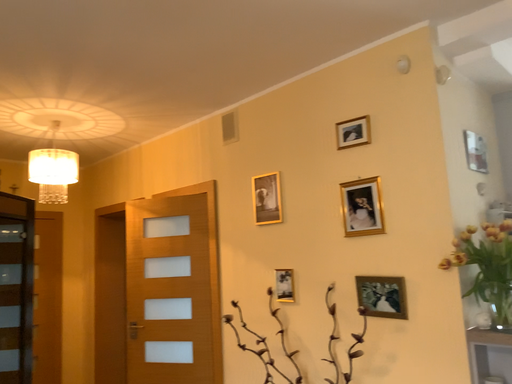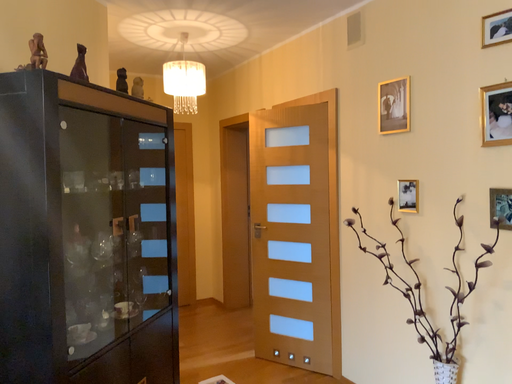
Question: How did the camera likely rotate when shooting the video?

Choices:
 (A) rotated downward
 (B) rotated upward

Answer: (A)